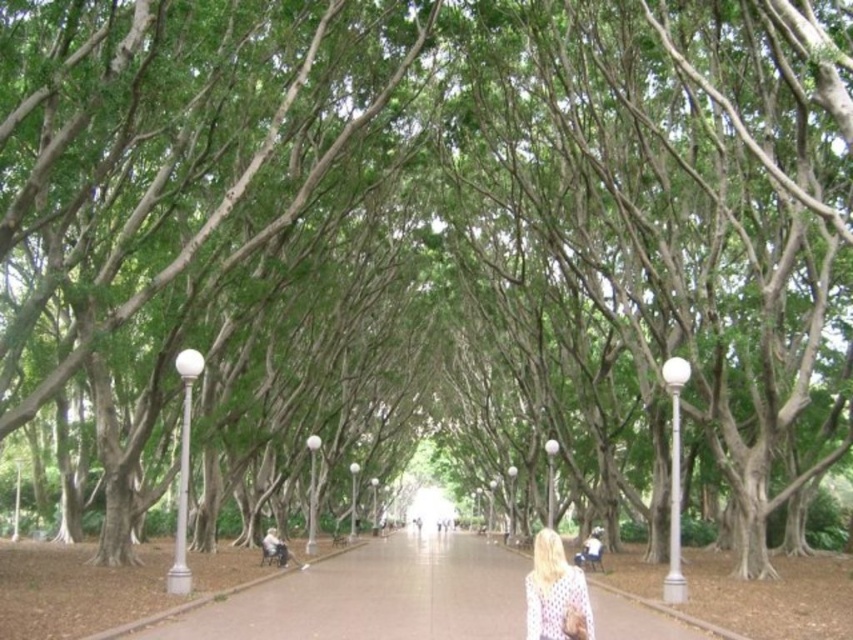
Who is positioned more to the right, smooth concrete path at center or white dotted sweater at center?

From the viewer's perspective, white dotted sweater at center appears more on the right side.

Based on the photo, can you confirm if smooth concrete path at center is positioned above white dotted sweater at center?

Incorrect, smooth concrete path at center is not positioned above white dotted sweater at center.

Locate an element on the screen. This screenshot has width=853, height=640. smooth concrete path at center is located at coordinates (366, 596).